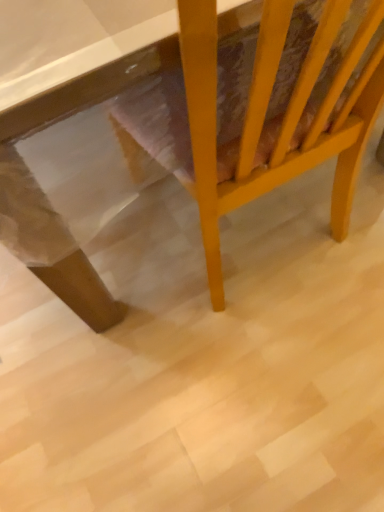
Measure the distance between yellow wood chair at center and camera.

The distance of yellow wood chair at center from camera is 13.48 inches.

Describe the element at coordinates (260, 111) in the screenshot. I see `yellow wood chair at center` at that location.

Where is `yellow wood chair at center`? Image resolution: width=384 pixels, height=512 pixels. yellow wood chair at center is located at coordinates (260, 111).

Find the location of a particular element. The height and width of the screenshot is (512, 384). yellow wood chair at center is located at coordinates (260, 111).